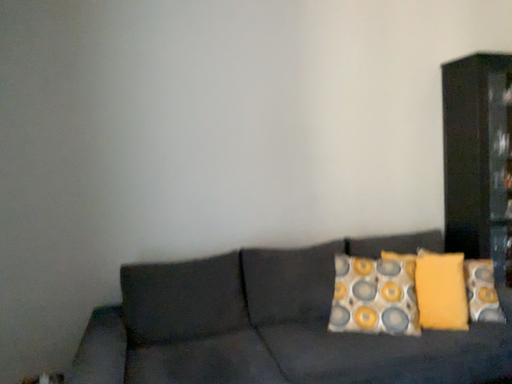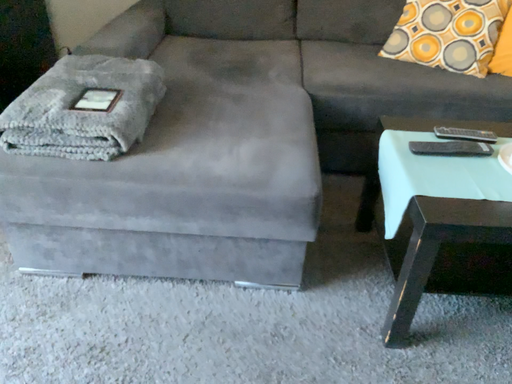
Question: How did the camera likely rotate when shooting the video?

Choices:
 (A) rotated downward
 (B) rotated upward

Answer: (A)